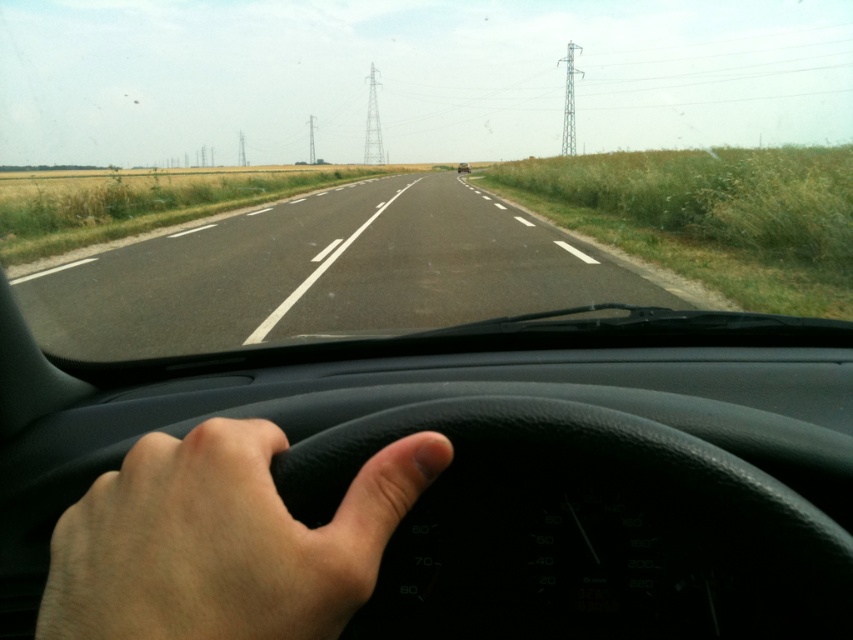
You are a passenger in the car and want to know which object is taller between the transparent glass windshield at center and the asphalt road at center. Can you determine this based on the view from inside the vehicle?

The transparent glass windshield at center is taller than the asphalt road at center.